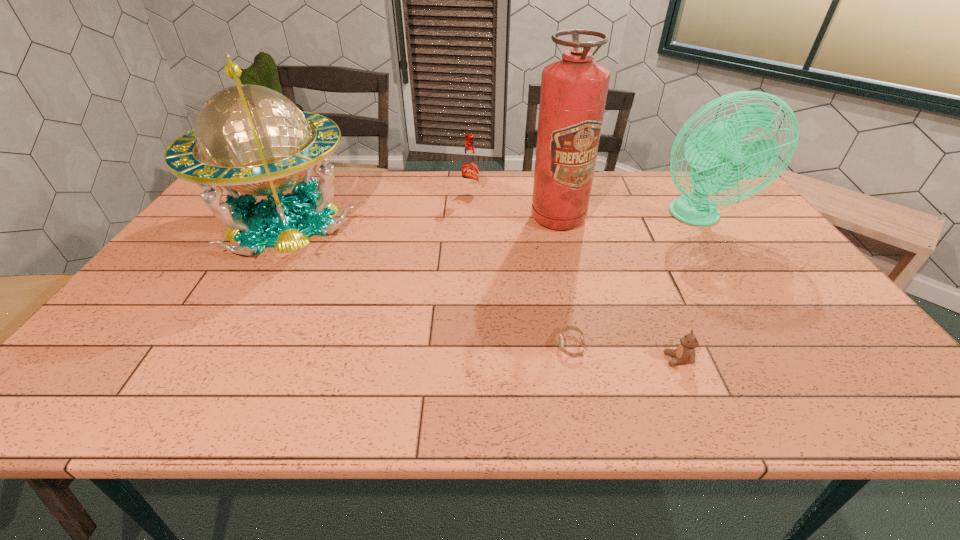
Where is `fire extinguisher`? This screenshot has width=960, height=540. fire extinguisher is located at coordinates (574, 89).

At what (x,y) coordinates should I click in order to perform the action: click on the leftmost object. Please return your answer as a coordinate pair (x, y). Looking at the image, I should click on (251, 139).

Locate an element on the screen. The height and width of the screenshot is (540, 960). fan is located at coordinates (715, 149).

The image size is (960, 540). Find the location of `the fourth tallest object`. the fourth tallest object is located at coordinates (469, 168).

In order to click on the second object from left to right in this screenshot , I will do `click(469, 168)`.

Locate an element on the screen. The width and height of the screenshot is (960, 540). the fifth object from left to right is located at coordinates (685, 353).

Where is `the fifth tallest object`? the fifth tallest object is located at coordinates (685, 353).

This screenshot has width=960, height=540. Find the location of `the shortest object`. the shortest object is located at coordinates (561, 342).

What are the coordinates of `vacant space located 0.060m on the label side of the fire extinguisher` in the screenshot? It's located at (564, 246).

Locate an element on the screen. This screenshot has height=540, width=960. vacant position located 0.250m on the right of the leftmost object is located at coordinates (439, 222).